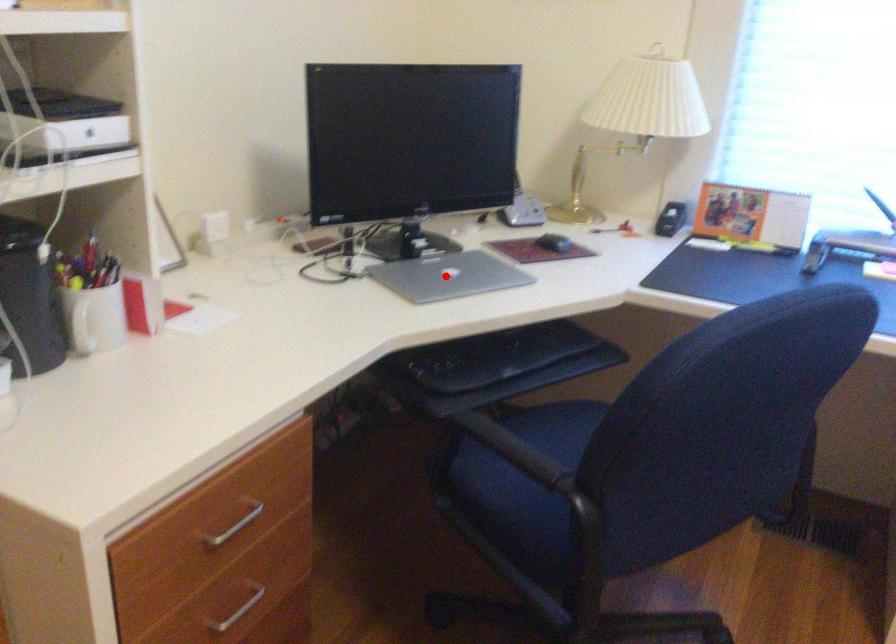
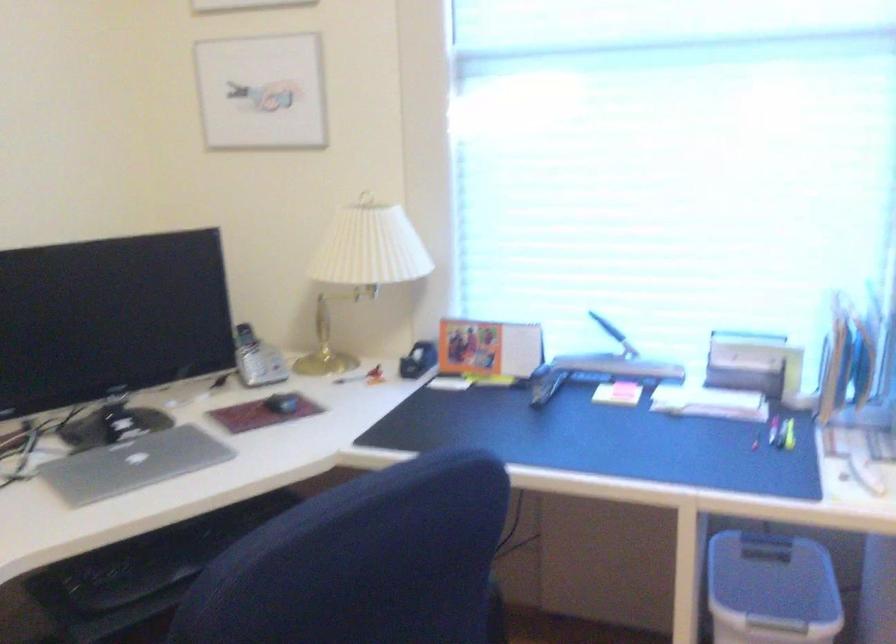
Find the pixel in the second image that matches the highlighted location in the first image.

(133, 464)